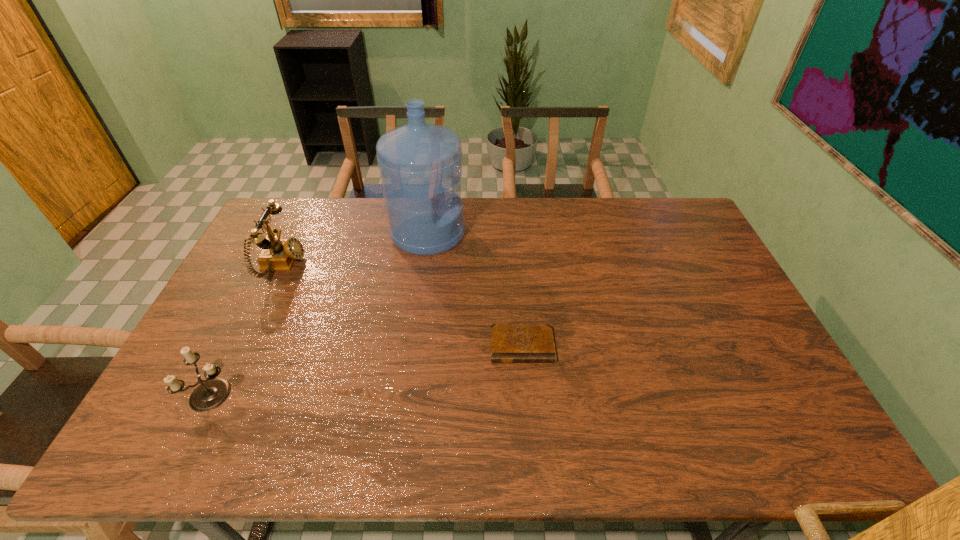
You are a GUI agent. You are given a task and a screenshot of the screen. Output one action in this format:
    pyautogui.click(x=<x>, y=<y>)
    Task: Click on the object that is the third nearest to the second nearest object
    This screenshot has width=960, height=540.
    Given the screenshot: What is the action you would take?
    pyautogui.click(x=211, y=393)

In order to click on object that is the second closest one to the nearest object in this screenshot , I will do `click(419, 162)`.

Find the location of a particular element. free region that satisfies the following two spatial constraints: 1. on the side of the tallest object with the handle; 2. on the front side of the candle holder is located at coordinates (406, 395).